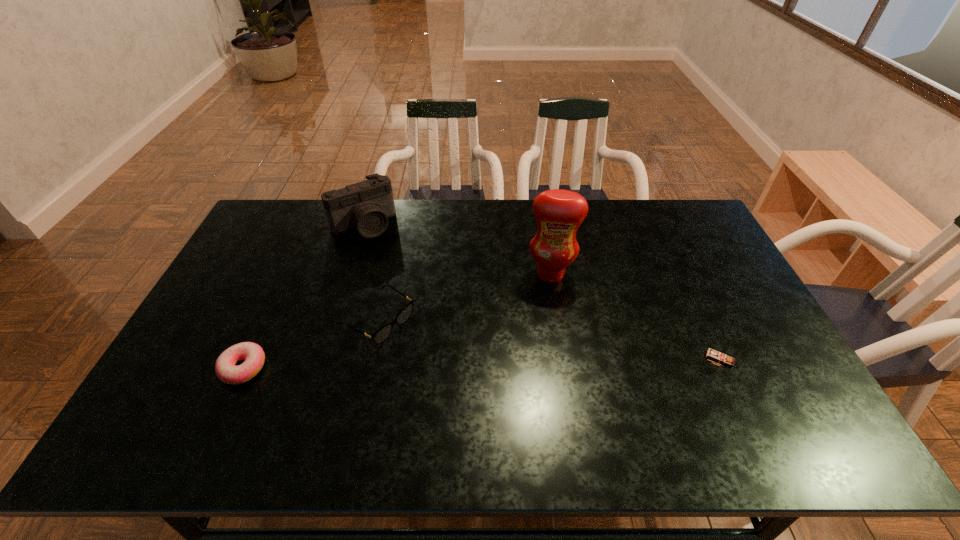
The width and height of the screenshot is (960, 540). Identify the location of free space at the near right corner. (797, 384).

Identify the location of vacant space in between the fourth tallest object and the leftmost object. (311, 343).

Identify the location of unoccupied area between the spectacles and the camera. The height and width of the screenshot is (540, 960). (371, 272).

Identify the location of free spot between the fourth object from left to right and the camera. (457, 249).

This screenshot has height=540, width=960. I want to click on free spot between the farthest object and the leftmost object, so click(303, 296).

The width and height of the screenshot is (960, 540). What are the coordinates of `empty space between the fourth tallest object and the second farthest object` in the screenshot? It's located at coord(465,296).

The width and height of the screenshot is (960, 540). Find the location of `vacant region between the camera and the condiment`. vacant region between the camera and the condiment is located at coordinates (457, 249).

Locate an element on the screen. unoccupied position between the spectacles and the third tallest object is located at coordinates (549, 339).

You are a GUI agent. You are given a task and a screenshot of the screen. Output one action in this format:
    pyautogui.click(x=<x>, y=<y>)
    Task: Click on the free space that is in between the fourth shortest object and the matchbox
    The image size is (960, 540).
    Given the screenshot: What is the action you would take?
    (x=541, y=292)

The image size is (960, 540). In order to click on free space between the fourth object from left to right and the rightmost object in this screenshot , I will do `click(636, 316)`.